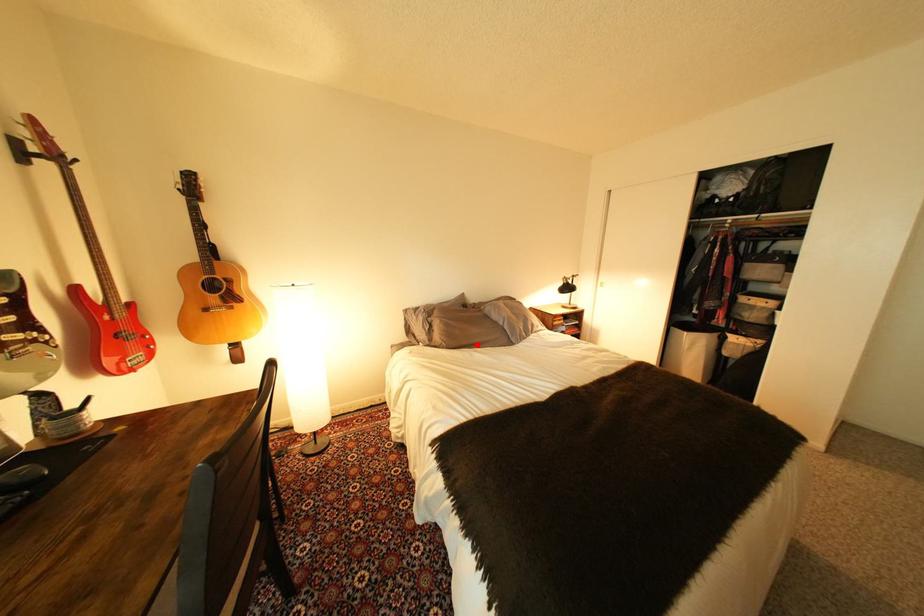
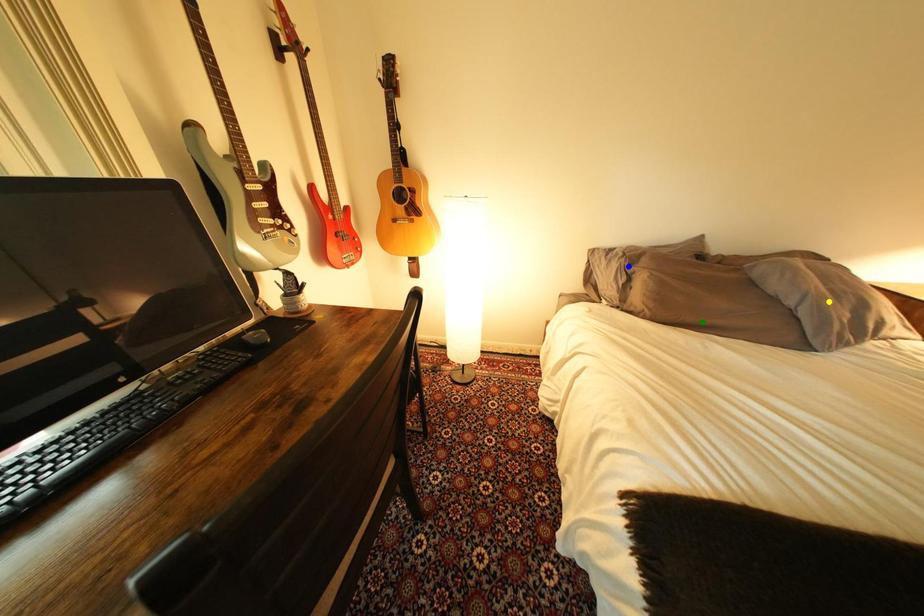
Question: I am providing you with two images of the same scene from different viewpoints. A red point is marked on the first image. You are given multiple points on the second image. Which point in image 2 represents the same 3d spot as the red point in image 1?

Choices:
 (A) green point
 (B) blue point
 (C) yellow point

Answer: (A)